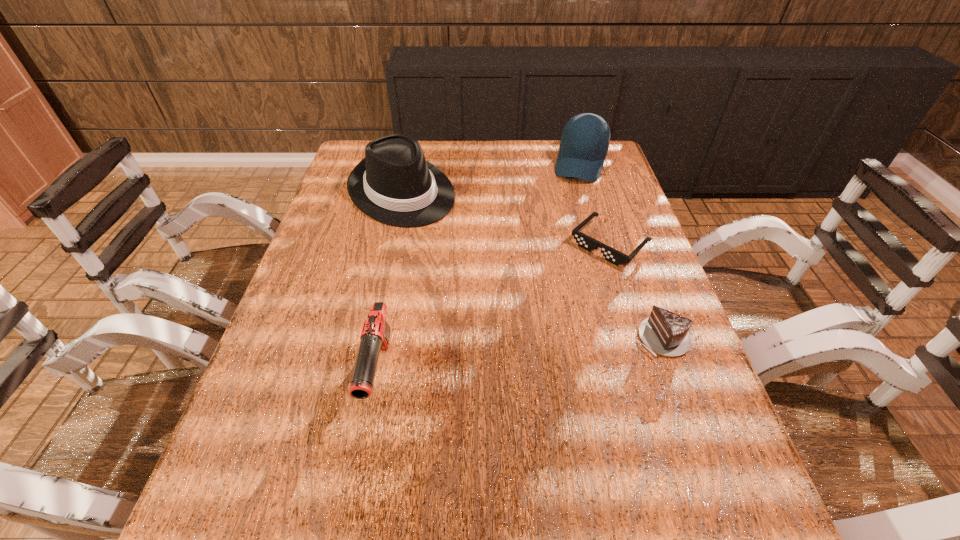
Image resolution: width=960 pixels, height=540 pixels. In order to click on baseball cap located in the right edge section of the desktop in this screenshot , I will do `click(585, 139)`.

Identify the location of sunglasses at the right edge. The image size is (960, 540). (584, 241).

Find the location of `object present at the far left corner`. object present at the far left corner is located at coordinates (394, 184).

Locate an element on the screen. The image size is (960, 540). object that is positioned at the far right corner is located at coordinates pyautogui.click(x=585, y=139).

In order to click on vacant space at the far edge of the desktop in this screenshot , I will do `click(477, 139)`.

You are a GUI agent. You are given a task and a screenshot of the screen. Output one action in this format:
    pyautogui.click(x=<x>, y=<y>)
    Task: Click on the vacant space at the left edge of the desktop
    This screenshot has width=960, height=540.
    Given the screenshot: What is the action you would take?
    pyautogui.click(x=314, y=313)

In the image, there is a desktop. Where is `vacant space at the right edge`? Image resolution: width=960 pixels, height=540 pixels. vacant space at the right edge is located at coordinates (618, 318).

This screenshot has width=960, height=540. Find the location of `free spot at the far left corner of the desktop`. free spot at the far left corner of the desktop is located at coordinates (359, 143).

In the image, there is a desktop. Where is `vacant space at the near left corner`? This screenshot has width=960, height=540. vacant space at the near left corner is located at coordinates (229, 469).

Locate an element on the screen. This screenshot has height=540, width=960. empty space that is in between the chocolate cake and the fedora is located at coordinates (531, 265).